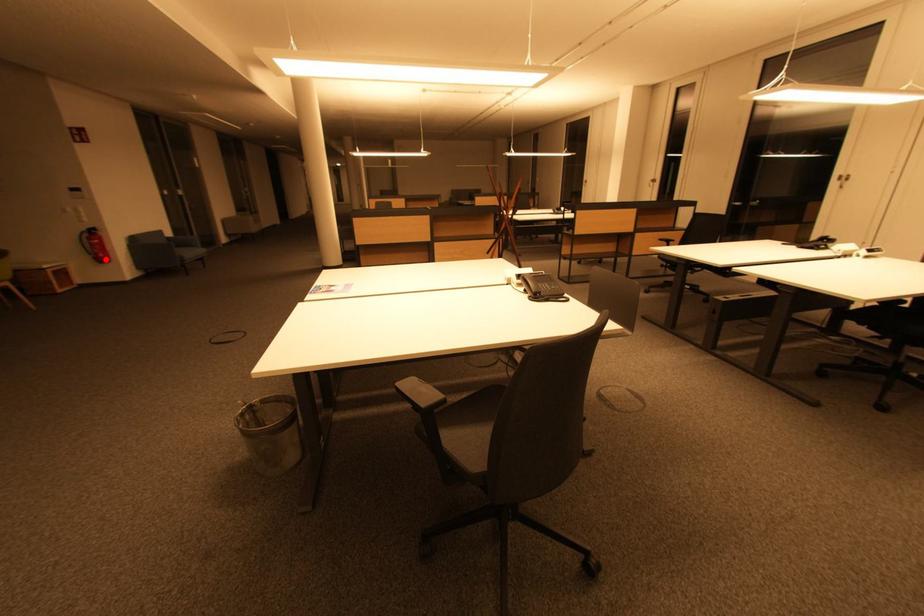
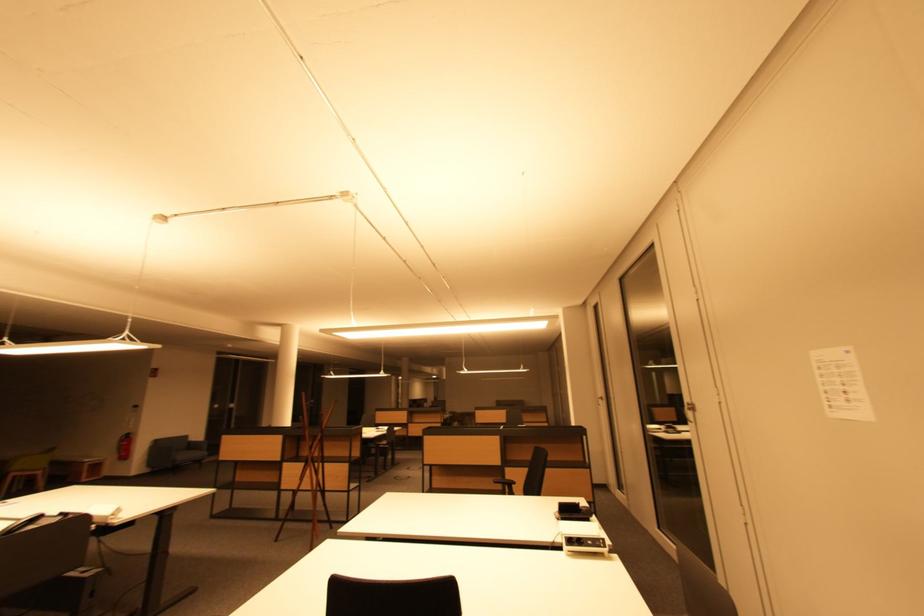
Question: I am providing you with two images of the same scene from different viewpoints. In image1, a red point is highlighted. Considering the same 3D point in image2, which of the following is correct?

Choices:
 (A) It is closer
 (B) It is farther

Answer: (A)